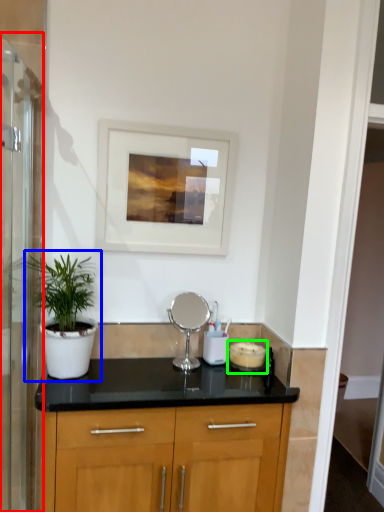
Question: Based on their relative distances, which object is farther from screen door (highlighted by a red box)? Choose from houseplant (highlighted by a blue box) and appliance (highlighted by a green box).

Choices:
 (A) houseplant
 (B) appliance

Answer: (B)